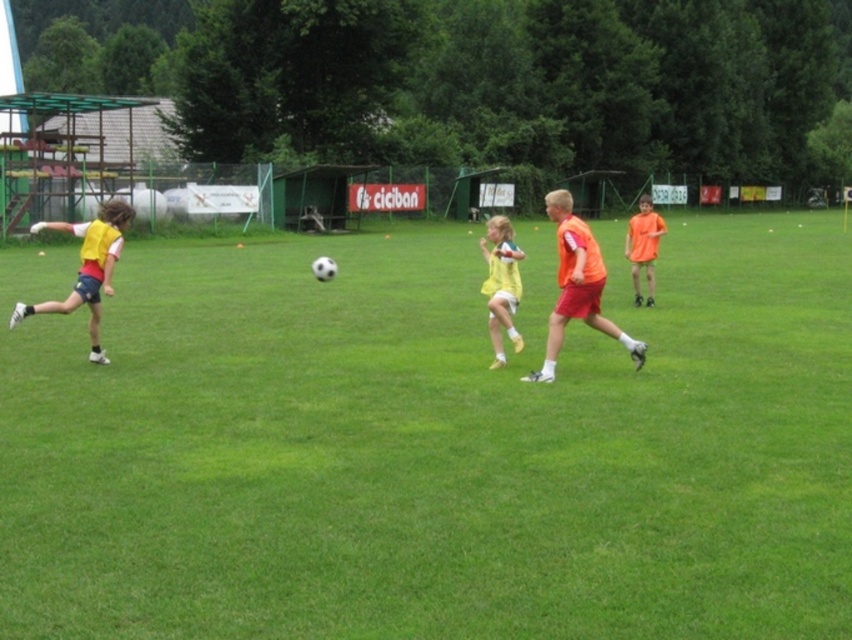
You are a soccer coach observing the game. The ball is at point (x=435, y=445). Where is the ball located in the field?

The ball is on the green grass at center, so the ball is located at the center of the field.

You are a soccer coach observing the game from the sidelines. The ball is currently in the air over the green grass at center. The player in the yellow matte jersey at left wants to reach the ball before it lands. Can they do it if they sprint at a speed of 7 meters per second and the ball will land in 0.8 seconds?

The distance between the green grass at center and the yellow matte jersey at left is 5.37 meters. The player needs to cover 5.37 meters in 0.8 seconds. Since 7 meters per second multiplied by 0.8 seconds equals 5.6 meters, which is slightly more than 5.37 meters, the player can reach the ball in time.

You are a soccer coach observing the game. You notice the green grass at center and the orange matte shirt at right. Which object is shorter in height?

The green grass at center is shorter in height compared to the orange matte shirt at right.